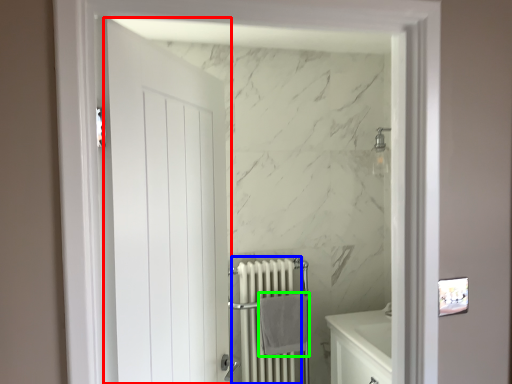
Question: Which object is positioned closest to door (highlighted by a red box)? Select from radiator (highlighted by a blue box) and bath towel (highlighted by a green box).

Choices:
 (A) radiator
 (B) bath towel

Answer: (B)